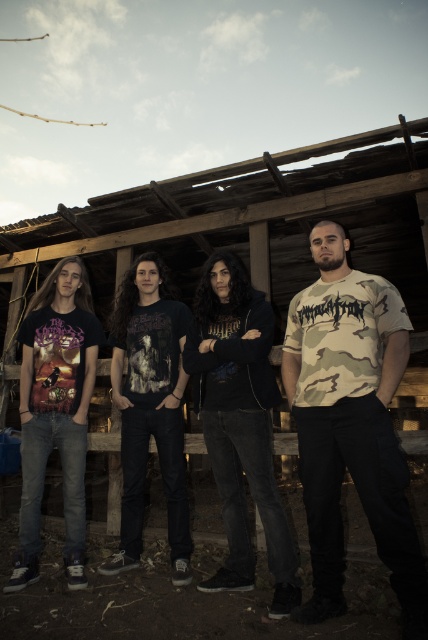
Measure the distance between camo fabric t-shirt at right and black matte hoodie at center.

camo fabric t-shirt at right and black matte hoodie at center are 18.62 inches apart from each other.

Is camo fabric t-shirt at right further to camera compared to black matte hoodie at center?

No, camo fabric t-shirt at right is closer to the viewer.

Image resolution: width=428 pixels, height=640 pixels. In order to click on camo fabric t-shirt at right in this screenshot , I will do `click(350, 424)`.

You are a GUI agent. You are given a task and a screenshot of the screen. Output one action in this format:
    pyautogui.click(x=<x>, y=<y>)
    Task: Click on the camo fabric t-shirt at right
    The image size is (428, 640).
    Given the screenshot: What is the action you would take?
    click(350, 424)